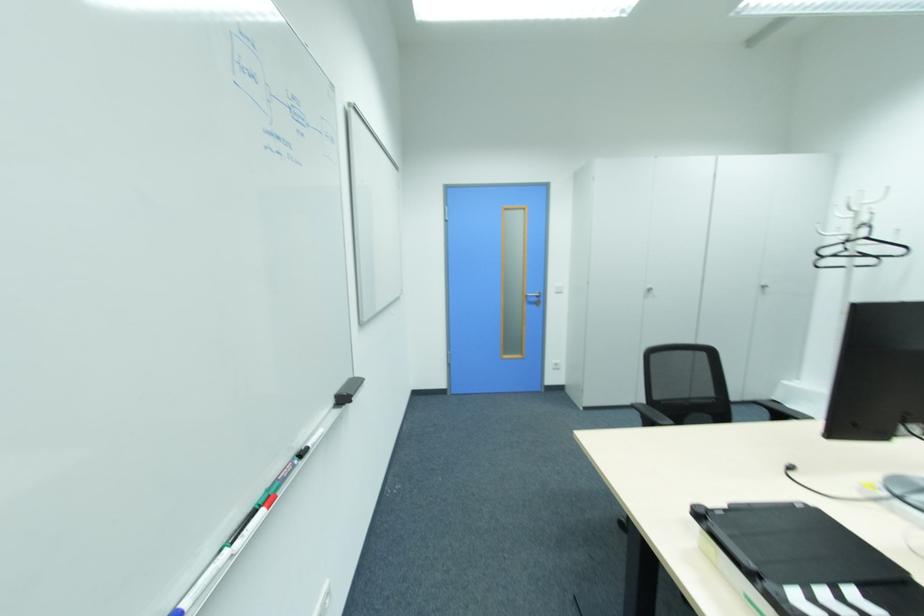
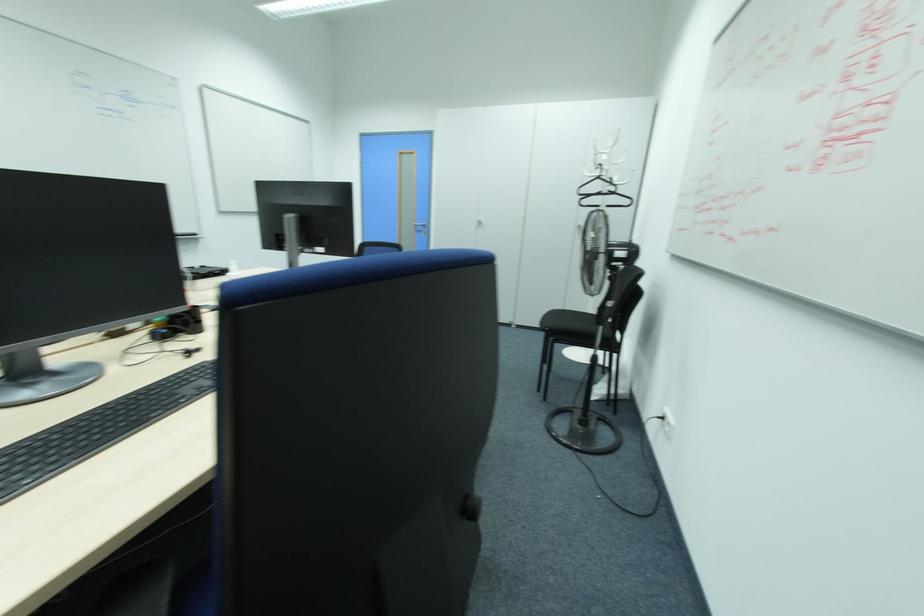
Where in the second image is the point corresponding to the point at 865,238 from the first image?

(599, 177)